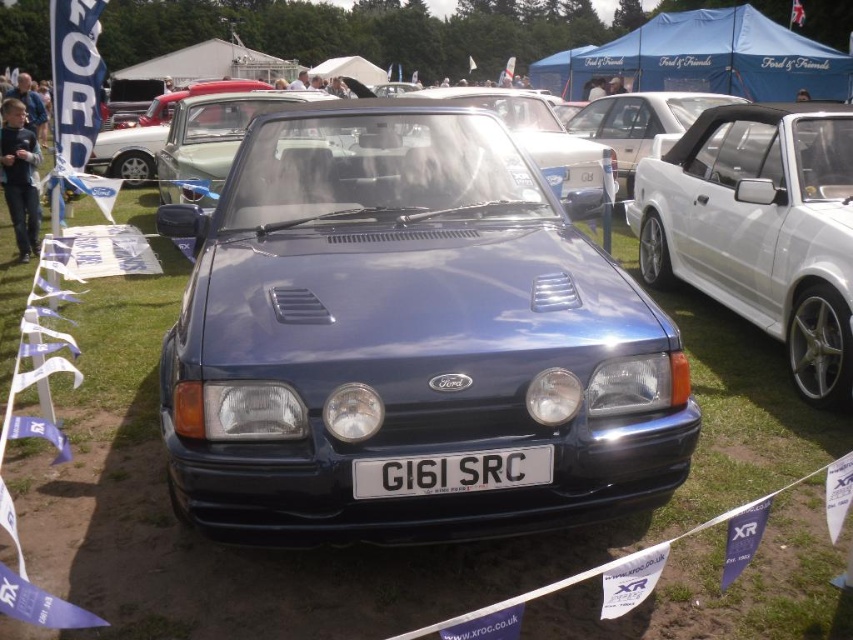
Is point (492, 330) in front of point (699, 220)?

Yes, it is.

Can you confirm if glossy blue car at center is positioned above white metallic sedan at right?

No, glossy blue car at center is not above white metallic sedan at right.

Where is `glossy blue car at center`? glossy blue car at center is located at coordinates (405, 336).

I want to click on glossy blue car at center, so click(x=405, y=336).

Is glossy blue car at center bigger than black plastic license plate at center?

Correct, glossy blue car at center is larger in size than black plastic license plate at center.

Is glossy blue car at center smaller than black plastic license plate at center?

No.

Who is more distant from viewer, (294,369) or (537,451)?

Point (537,451)

The image size is (853, 640). In order to click on glossy blue car at center in this screenshot , I will do `click(405, 336)`.

Between white metallic sedan at right and black plastic license plate at center, which one has less height?

With less height is black plastic license plate at center.

Between white metallic sedan at right and black plastic license plate at center, which one has more height?

Standing taller between the two is white metallic sedan at right.

You are a GUI agent. You are given a task and a screenshot of the screen. Output one action in this format:
    pyautogui.click(x=<x>, y=<y>)
    Task: Click on the white metallic sedan at right
    The width and height of the screenshot is (853, 640).
    Given the screenshot: What is the action you would take?
    coord(761,228)